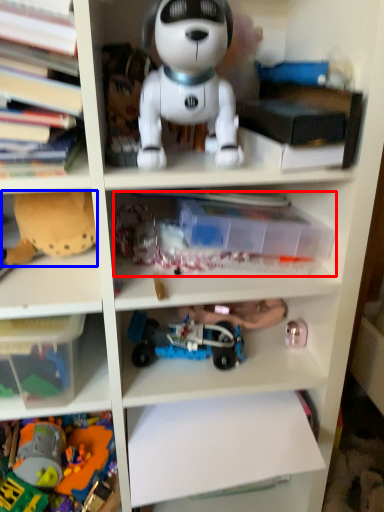
Question: Which of the following is the farthest to the observer, book (highlighted by a red box) or toy (highlighted by a blue box)?

Choices:
 (A) book
 (B) toy

Answer: (B)